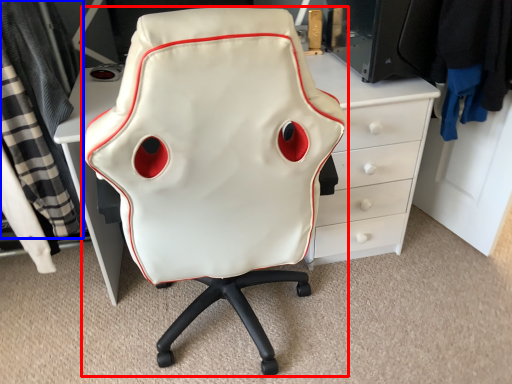
Question: Which object is closer to the camera taking this photo, chair (highlighted by a red box) or clothing (highlighted by a blue box)?

Choices:
 (A) chair
 (B) clothing

Answer: (A)